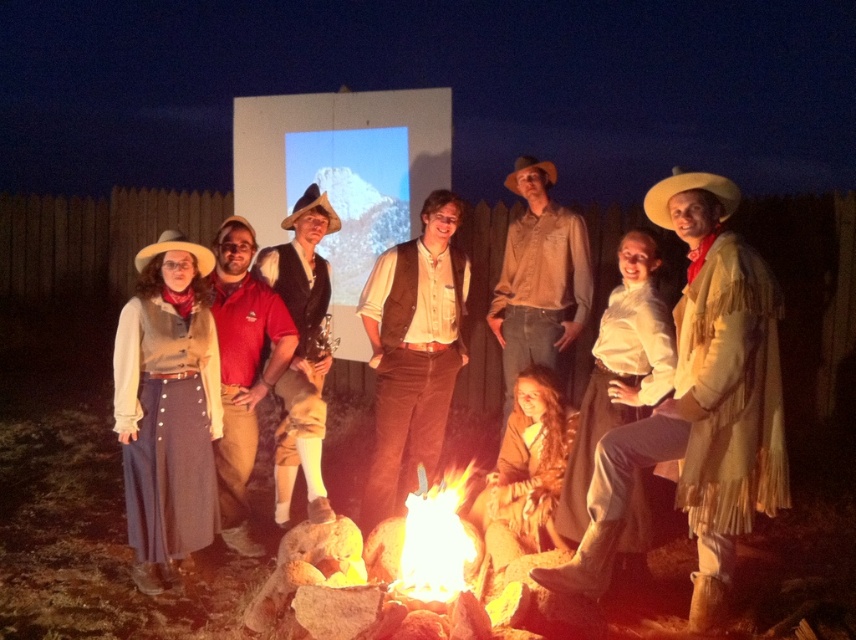
Question: Which object is positioned farthest from the brown leather jacket at lower center?

Choices:
 (A) brown felt cowboy hat at center
 (B) velvet brown vest at center
 (C) light brown leather shirt at center
 (D) brown suede vest at center

Answer: (A)

Question: Which of these objects is positioned closest to the matte brown vest at center?

Choices:
 (A) white cotton blouse at center
 (B) flaming wood at center
 (C) brown leather jacket at lower center

Answer: (A)

Question: Can you confirm if brown leather jacket at lower center is bigger than light brown felt cowboy hat at left?

Choices:
 (A) no
 (B) yes

Answer: (B)

Question: Is white cotton blouse at center smaller than light brown straw cowboy hat at right?

Choices:
 (A) yes
 (B) no

Answer: (B)

Question: Which of the following is the closest to the observer?

Choices:
 (A) (688, 355)
 (B) (485, 317)
 (C) (248, 362)
 (D) (197, 260)

Answer: (A)

Question: Is flaming wood at center thinner than brown felt cowboy hat at center?

Choices:
 (A) no
 (B) yes

Answer: (A)